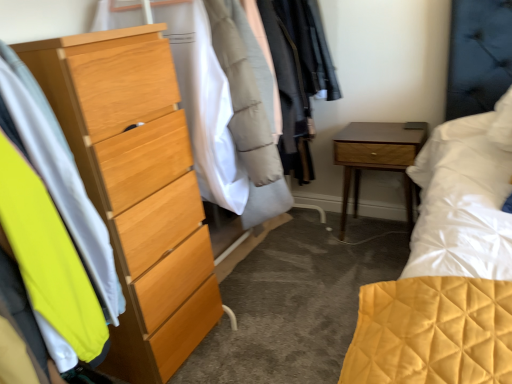
Question: Is wooden nightstand at lower right wider or thinner than neon yellow fabric at left?

Choices:
 (A) wide
 (B) thin

Answer: (A)

Question: From the image's perspective, relative to neon yellow fabric at left, is wooden nightstand at lower right above or below?

Choices:
 (A) above
 (B) below

Answer: (A)

Question: Which of these objects is positioned closest to the wooden nightstand at lower right?

Choices:
 (A) neon yellow fabric at left
 (B) light wood dresser at left

Answer: (B)

Question: Based on their relative distances, which object is nearer to the wooden nightstand at lower right?

Choices:
 (A) light wood dresser at left
 (B) neon yellow fabric at left

Answer: (A)